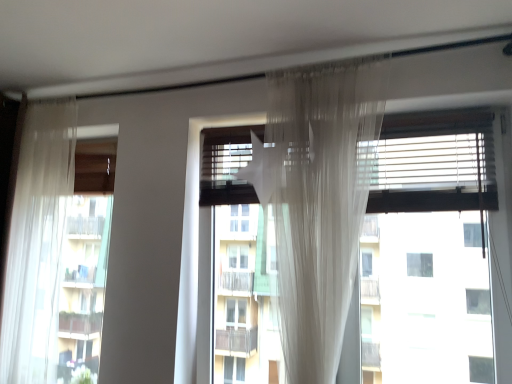
Question: Does sheer white curtain at left appear on the right side of transparent fabric at center?

Choices:
 (A) yes
 (B) no

Answer: (B)

Question: Considering the relative sizes of sheer white curtain at left and transparent fabric at center in the image provided, is sheer white curtain at left shorter than transparent fabric at center?

Choices:
 (A) no
 (B) yes

Answer: (A)

Question: Is sheer white curtain at left oriented towards transparent fabric at center?

Choices:
 (A) no
 (B) yes

Answer: (A)

Question: Is sheer white curtain at left behind transparent fabric at center?

Choices:
 (A) no
 (B) yes

Answer: (B)

Question: Considering the relative positions of sheer white curtain at left and transparent fabric at center in the image provided, is sheer white curtain at left to the left of transparent fabric at center from the viewer's perspective?

Choices:
 (A) yes
 (B) no

Answer: (A)

Question: Are sheer white curtain at left and transparent fabric at center making contact?

Choices:
 (A) yes
 (B) no

Answer: (B)

Question: Is transparent fabric at center thinner than sheer white curtain at left?

Choices:
 (A) yes
 (B) no

Answer: (A)

Question: Is transparent fabric at center oriented towards sheer white curtain at left?

Choices:
 (A) no
 (B) yes

Answer: (B)

Question: From a real-world perspective, is transparent fabric at center beneath sheer white curtain at left?

Choices:
 (A) yes
 (B) no

Answer: (A)

Question: Can we say transparent fabric at center lies outside sheer white curtain at left?

Choices:
 (A) yes
 (B) no

Answer: (A)

Question: Is there a large distance between transparent fabric at center and sheer white curtain at left?

Choices:
 (A) no
 (B) yes

Answer: (B)

Question: Is transparent fabric at center further to camera compared to sheer white curtain at left?

Choices:
 (A) no
 (B) yes

Answer: (A)

Question: From a real-world perspective, relative to transparent fabric at center, is sheer white curtain at left vertically above or below?

Choices:
 (A) above
 (B) below

Answer: (A)